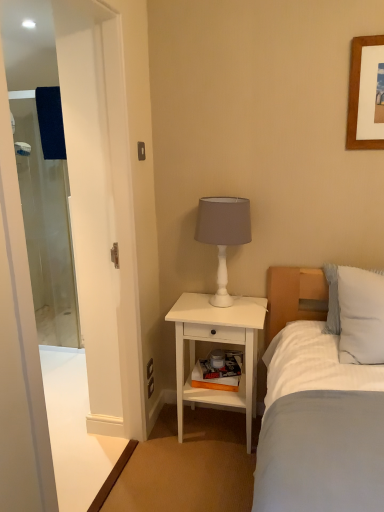
What do you see at coordinates (361, 316) in the screenshot?
I see `white striped pillow at right` at bounding box center [361, 316].

At what (x,y) coordinates should I click in order to perform the action: click on white matte nightstand at center. Please return your answer as a coordinate pair (x, y). Looking at the image, I should click on (221, 343).

Locate an element on the screen. Image resolution: width=384 pixels, height=512 pixels. white striped pillow at right is located at coordinates (361, 316).

Where is `screen door that is above the clear glass screen door at left, which ranks as the 1th screen door in left-to-right order (from a real-world perspective)`? screen door that is above the clear glass screen door at left, which ranks as the 1th screen door in left-to-right order (from a real-world perspective) is located at coordinates (102, 212).

Would you say clear glass screen door at left, which ranks as the 1th screen door in left-to-right order, contains transparent glass screen door at left, acting as the 1th screen door starting from the front?

No.

From a real-world perspective, is clear glass screen door at left, the 2th screen door in the right-to-left sequence, over transparent glass screen door at left, the second screen door viewed from the back?

Incorrect, from a real-world perspective, clear glass screen door at left, the 2th screen door in the right-to-left sequence, is lower than transparent glass screen door at left, the second screen door viewed from the back.

Which of these two, white striped pillow at right or white matte table lamp at upper right, is smaller?

white striped pillow at right.

Is there a large distance between white striped pillow at right and white matte table lamp at upper right?

No.

Does white striped pillow at right have a greater width compared to white matte table lamp at upper right?

Indeed, white striped pillow at right has a greater width compared to white matte table lamp at upper right.

From the image's perspective, is transparent glass screen door at left, acting as the 1th screen door starting from the right, above or below white matte nightstand at center?

Clearly, from the image's perspective, transparent glass screen door at left, acting as the 1th screen door starting from the right, is above white matte nightstand at center.

From the image's perspective, count 1st screen doors upward from the white matte nightstand at center and point to it. Please provide its 2D coordinates.

[(102, 212)]

Which point is more distant from viewer, (78,263) or (233,340)?

Point (78,263)

Is transparent glass screen door at left, acting as the 1th screen door starting from the right, not near white matte nightstand at center?

transparent glass screen door at left, acting as the 1th screen door starting from the right, is near white matte nightstand at center, not far away.

Is white matte nightstand at center looking in the opposite direction of clear glass screen door at left, arranged as the 1th screen door when viewed from the back?

No, white matte nightstand at center is not facing away from clear glass screen door at left, arranged as the 1th screen door when viewed from the back.

Considering the sizes of white matte nightstand at center and clear glass screen door at left, the 2th screen door in the right-to-left sequence, in the image, is white matte nightstand at center taller or shorter than clear glass screen door at left, the 2th screen door in the right-to-left sequence,?

Clearly, white matte nightstand at center is shorter compared to clear glass screen door at left, the 2th screen door in the right-to-left sequence.

From the image's perspective, which one is positioned lower, white matte nightstand at center or clear glass screen door at left, arranged as the 1th screen door when viewed from the back?

white matte nightstand at center is shown below in the image.

Does white matte nightstand at center have a larger size compared to clear glass screen door at left, which is counted as the 2th screen door, starting from the front?

No.

Identify the location of table lamp that is above the transparent glass screen door at left, acting as the 1th screen door starting from the front (from the image's perspective). Image resolution: width=384 pixels, height=512 pixels. (223, 234).

Is transparent glass screen door at left, acting as the 1th screen door starting from the right, touching white matte table lamp at upper right?

No, transparent glass screen door at left, acting as the 1th screen door starting from the right, is not in contact with white matte table lamp at upper right.

From the image's perspective, who appears lower, transparent glass screen door at left, the 2th screen door from the left, or white matte table lamp at upper right?

From the image's view, transparent glass screen door at left, the 2th screen door from the left, is below.

Consider the image. In terms of height, does transparent glass screen door at left, the second screen door viewed from the back, look taller or shorter compared to white matte table lamp at upper right?

Considering their sizes, transparent glass screen door at left, the second screen door viewed from the back, has more height than white matte table lamp at upper right.

Is white matte table lamp at upper right facing towards white matte nightstand at center?

No, white matte table lamp at upper right does not turn towards white matte nightstand at center.

Where is `nightstand behind the white matte table lamp at upper right`? This screenshot has height=512, width=384. nightstand behind the white matte table lamp at upper right is located at coordinates click(221, 343).

Who is shorter, white matte table lamp at upper right or white matte nightstand at center?

With less height is white matte table lamp at upper right.

Can you confirm if white matte table lamp at upper right is thinner than white matte nightstand at center?

Correct, the width of white matte table lamp at upper right is less than that of white matte nightstand at center.

Is white matte table lamp at upper right taller or shorter than clear glass screen door at left, arranged as the 1th screen door when viewed from the back?

Clearly, white matte table lamp at upper right is shorter compared to clear glass screen door at left, arranged as the 1th screen door when viewed from the back.

Consider the image. From a real-world perspective, is white matte table lamp at upper right on clear glass screen door at left, arranged as the 1th screen door when viewed from the back?

Yes, from a real-world perspective, white matte table lamp at upper right is on top of clear glass screen door at left, arranged as the 1th screen door when viewed from the back.

How much distance is there between white matte table lamp at upper right and clear glass screen door at left, arranged as the 1th screen door when viewed from the back?

They are 6.03 feet apart.

Does white matte table lamp at upper right have a lesser width compared to clear glass screen door at left, which is counted as the 2th screen door, starting from the front?

Incorrect, the width of white matte table lamp at upper right is not less than that of clear glass screen door at left, which is counted as the 2th screen door, starting from the front.

At what (x,y) coordinates should I click in order to perform the action: click on screen door above the transparent glass screen door at left, acting as the 1th screen door starting from the front (from the image's perspective). Please return your answer as a coordinate pair (x, y). Looking at the image, I should click on (46, 228).

Where is `pillow beneath the white matte table lamp at upper right (from a real-world perspective)`? This screenshot has height=512, width=384. pillow beneath the white matte table lamp at upper right (from a real-world perspective) is located at coordinates (361, 316).

From the image, which object appears to be nearer to white striped pillow at right, white matte table lamp at upper right or clear glass screen door at left, arranged as the 1th screen door when viewed from the back?

The object closer to white striped pillow at right is white matte table lamp at upper right.

From the image, which object appears to be nearer to white matte nightstand at center, white matte table lamp at upper right or transparent glass screen door at left, the 2th screen door from the left?

white matte table lamp at upper right lies closer to white matte nightstand at center than the other object.

From the image, which object appears to be nearer to white matte nightstand at center, white striped pillow at right or white matte table lamp at upper right?

white matte table lamp at upper right.

Considering their positions, is transparent glass screen door at left, acting as the 1th screen door starting from the front, positioned further to white matte nightstand at center than white striped pillow at right?

Based on the image, white striped pillow at right appears to be further to white matte nightstand at center.

Looking at the image, which one is located closer to clear glass screen door at left, which ranks as the 1th screen door in left-to-right order, white matte table lamp at upper right or white striped pillow at right?

The object closer to clear glass screen door at left, which ranks as the 1th screen door in left-to-right order, is white matte table lamp at upper right.

From the picture: Considering their positions, is clear glass screen door at left, which ranks as the 1th screen door in left-to-right order, positioned further to white matte nightstand at center than white striped pillow at right?

clear glass screen door at left, which ranks as the 1th screen door in left-to-right order, is further to white matte nightstand at center.

From the image, which object appears to be nearer to clear glass screen door at left, which ranks as the 1th screen door in left-to-right order, white matte nightstand at center or white striped pillow at right?

white matte nightstand at center lies closer to clear glass screen door at left, which ranks as the 1th screen door in left-to-right order, than the other object.

Considering their positions, is white matte nightstand at center positioned further to transparent glass screen door at left, acting as the 1th screen door starting from the front, than white matte table lamp at upper right?

white matte table lamp at upper right is positioned further to the anchor transparent glass screen door at left, acting as the 1th screen door starting from the front.

The width and height of the screenshot is (384, 512). Identify the location of table lamp located between transparent glass screen door at left, the second screen door viewed from the back, and white matte nightstand at center in the depth direction. (223, 234).

Identify the location of table lamp between clear glass screen door at left, arranged as the 1th screen door when viewed from the back, and white striped pillow at right, in the horizontal direction. (223, 234).

This screenshot has width=384, height=512. Identify the location of table lamp situated between transparent glass screen door at left, the 2th screen door from the left, and white striped pillow at right from left to right. (223, 234).

I want to click on table lamp located between transparent glass screen door at left, acting as the 1th screen door starting from the right, and clear glass screen door at left, the 2th screen door in the right-to-left sequence, in the depth direction, so click(x=223, y=234).